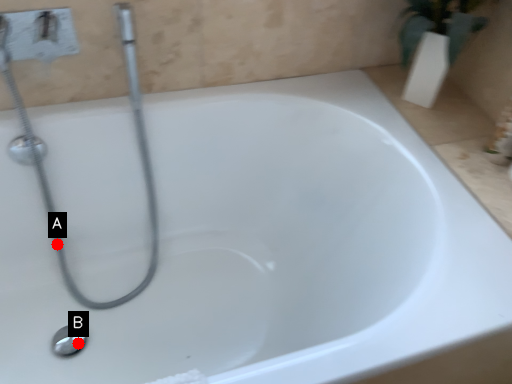
Question: Two points are circled on the image, labeled by A and B beside each circle. Among these points, which one is farthest from the camera?

Choices:
 (A) A is further
 (B) B is further

Answer: (A)